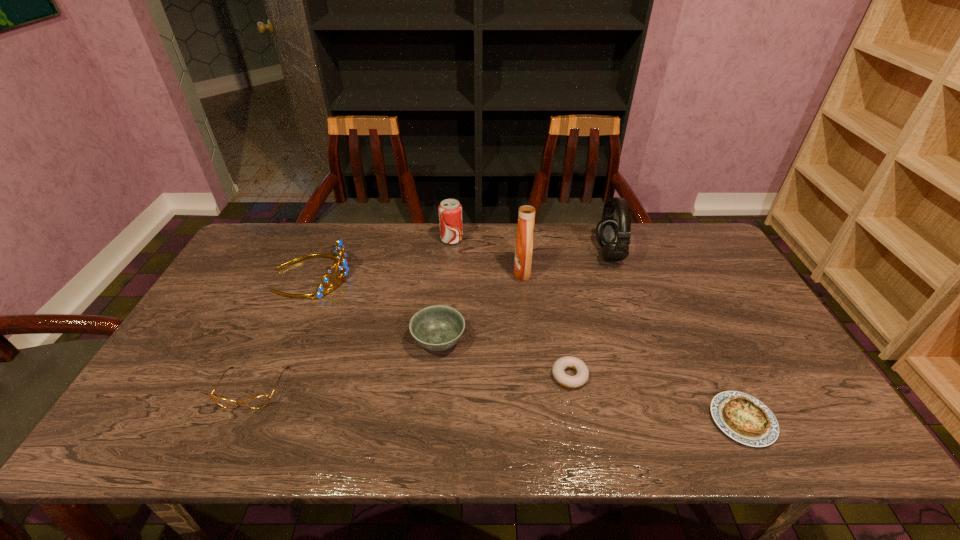
The image size is (960, 540). Find the location of `free point that satisfies the following two spatial constraints: 1. on the back side of the quiche; 2. on the front-facing side of the tiara`. free point that satisfies the following two spatial constraints: 1. on the back side of the quiche; 2. on the front-facing side of the tiara is located at coordinates (670, 275).

Locate an element on the screen. This screenshot has height=540, width=960. blank area in the image that satisfies the following two spatial constraints: 1. on the earcups of the headset; 2. on the back side of the quiche is located at coordinates (668, 420).

Where is `free region that satisfies the following two spatial constraints: 1. on the earcups of the rightmost object; 2. on the right side of the seventh shortest object`? The width and height of the screenshot is (960, 540). free region that satisfies the following two spatial constraints: 1. on the earcups of the rightmost object; 2. on the right side of the seventh shortest object is located at coordinates (668, 420).

Identify the location of vacant position in the image that satisfies the following two spatial constraints: 1. on the front-facing side of the detergent; 2. on the front-facing side of the third shortest object. The height and width of the screenshot is (540, 960). (535, 388).

This screenshot has width=960, height=540. Find the location of `free location that satisfies the following two spatial constraints: 1. on the front-facing side of the tiara; 2. on the right side of the quiche`. free location that satisfies the following two spatial constraints: 1. on the front-facing side of the tiara; 2. on the right side of the quiche is located at coordinates (249, 420).